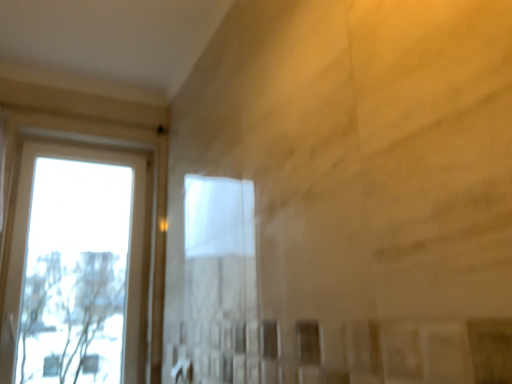
This screenshot has height=384, width=512. What do you see at coordinates (144, 214) in the screenshot? I see `transparent glass window at left` at bounding box center [144, 214].

Locate an element on the screen. transparent glass window at left is located at coordinates (144, 214).

Image resolution: width=512 pixels, height=384 pixels. Find the location of `transparent glass window at left`. transparent glass window at left is located at coordinates (144, 214).